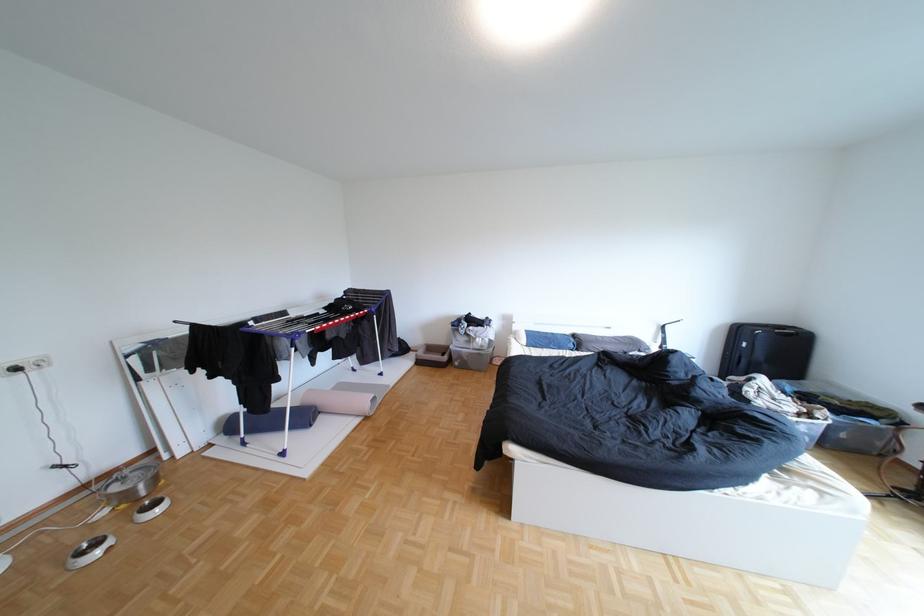
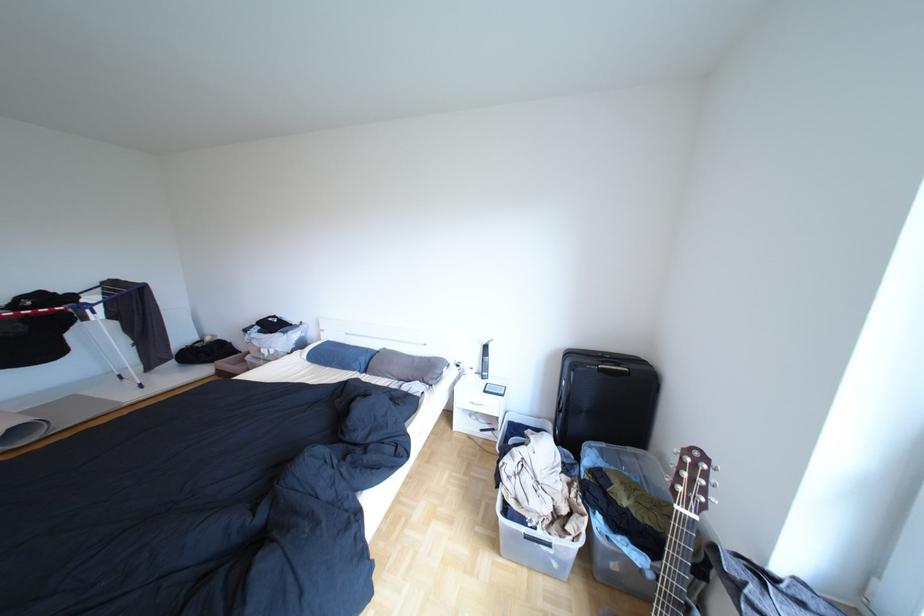
Question: What movement of the cameraman would produce the second image?

Choices:
 (A) Left
 (B) Right
 (C) Forward
 (D) Backward

Answer: (B)